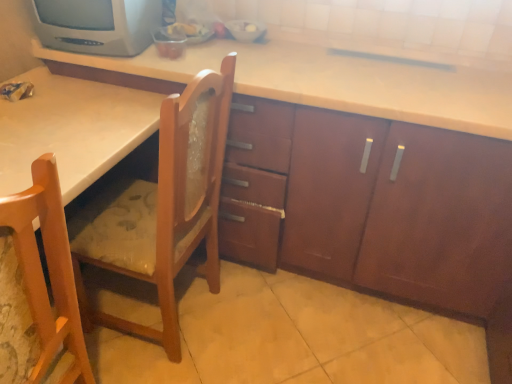
At what (x,y) coordinates should I click in order to perform the action: click on vacant space in wooden chair at center, which is the first chair from back to front (from a real-world perspective). Please return your answer as a coordinate pair (x, y). This screenshot has height=384, width=512. Looking at the image, I should click on (185, 317).